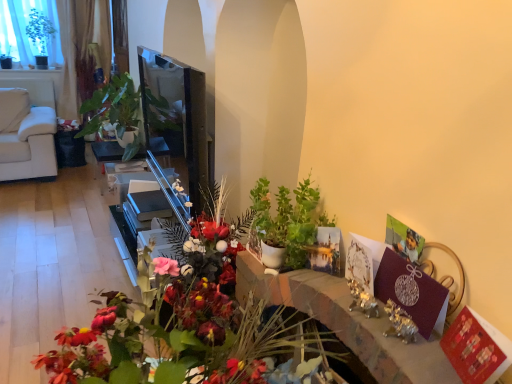
Question: Is green matte plant at center, acting as the first houseplant starting from the bottom, to the left or to the right of matte black table at center in the image?

Choices:
 (A) left
 (B) right

Answer: (B)

Question: Is point (274, 238) positioned closer to the camera than point (101, 152)?

Choices:
 (A) farther
 (B) closer

Answer: (B)

Question: Based on their relative distances, which object is farther from the green matte plant at center, placed as the 1th houseplant when sorted from front to back?

Choices:
 (A) matte floral arrangement at center
 (B) green glossy plant at upper left, acting as the second houseplant starting from the front
 (C) matte black table at center
 (D) green leafy plant at upper left

Answer: (D)

Question: Estimate the real-world distances between objects in this image. Which object is farther from the green glossy plant at upper left, positioned as the 1th houseplant in left-to-right order?

Choices:
 (A) green matte plant at center, placed as the first houseplant when sorted from right to left
 (B) green leafy plant at upper left
 (C) matte floral arrangement at center
 (D) matte black table at center

Answer: (C)